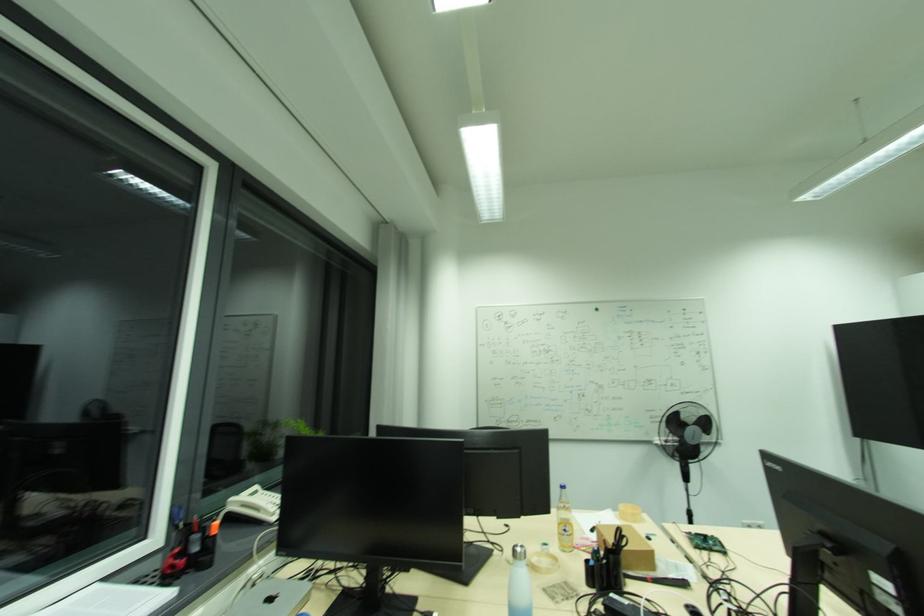
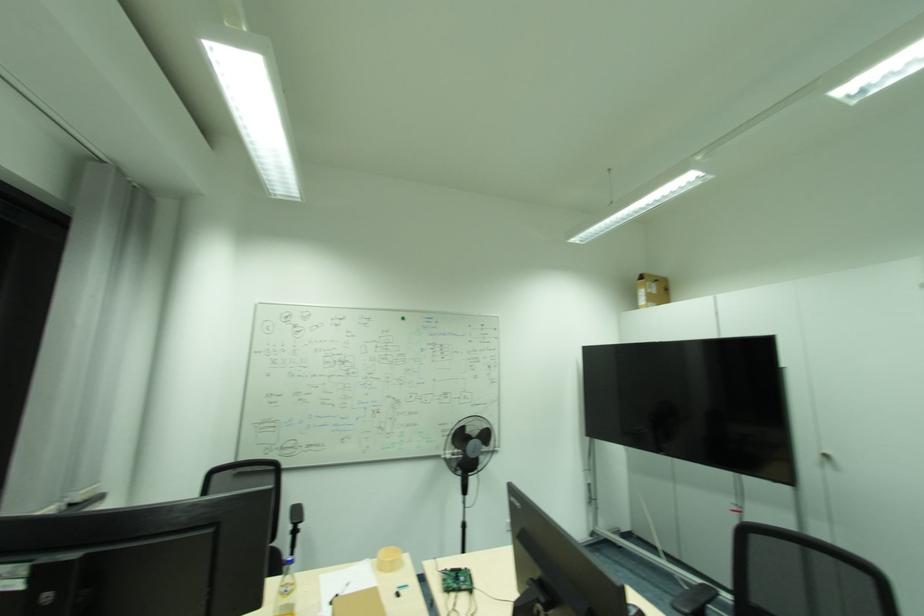
Locate, in the second image, the point that corresponds to [626,507] in the first image.

(386, 553)